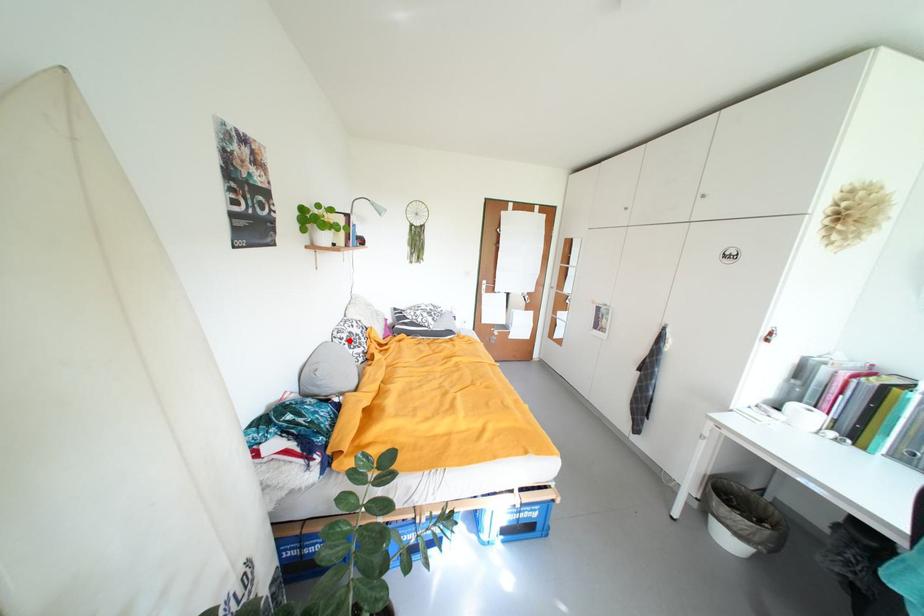
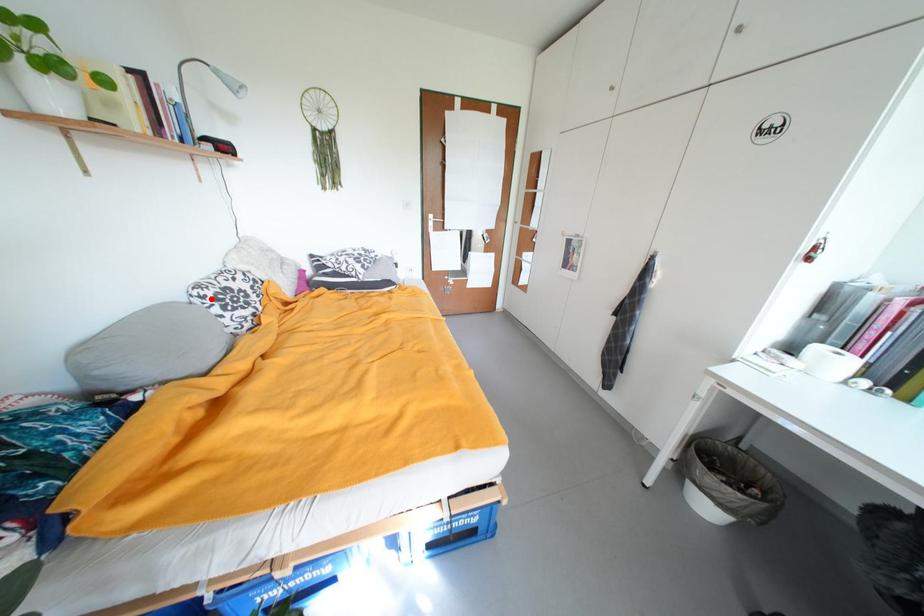
I am providing you with two images of the same scene from different viewpoints. A red point is marked on the first image and another point is marked on the second image. Does the point marked in image1 correspond to the same location as the one in image2?

Yes